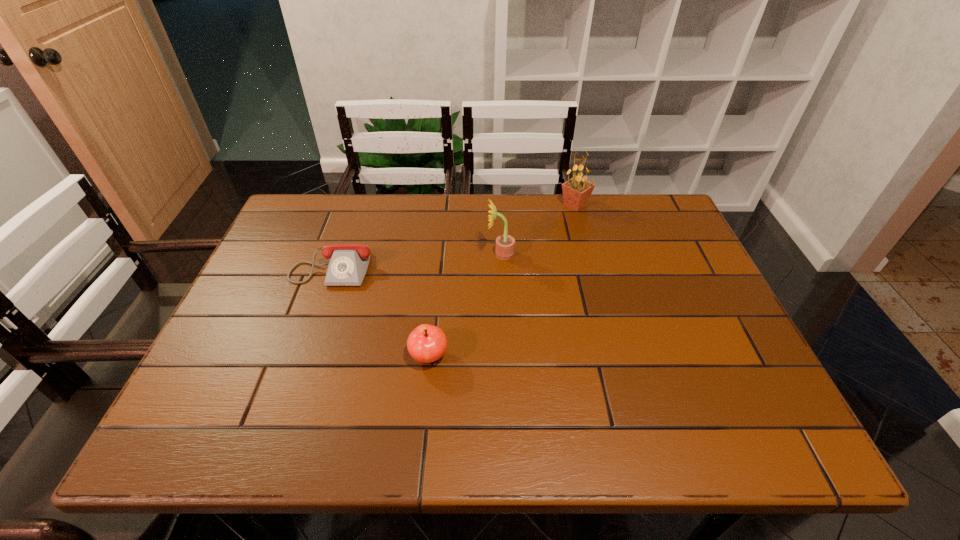
The image size is (960, 540). In order to click on the right sunflower in this screenshot , I will do `click(576, 191)`.

The image size is (960, 540). Find the location of `the farther sunflower`. the farther sunflower is located at coordinates coord(576,191).

The width and height of the screenshot is (960, 540). What are the coordinates of `the left sunflower` in the screenshot? It's located at (505, 244).

This screenshot has width=960, height=540. I want to click on the second object from right to left, so click(505, 244).

Locate an element on the screen. This screenshot has height=540, width=960. apple is located at coordinates (427, 343).

Find the location of `the third tallest object`. the third tallest object is located at coordinates (427, 343).

You are a GUI agent. You are given a task and a screenshot of the screen. Output one action in this format:
    pyautogui.click(x=<x>, y=<y>)
    Task: Click on the shortest object
    The height and width of the screenshot is (540, 960).
    Given the screenshot: What is the action you would take?
    pyautogui.click(x=348, y=264)

Locate an element on the screen. The image size is (960, 540). the leftmost object is located at coordinates (348, 264).

Find the location of `vacant region located at the front of the farther sunflower with flowers visible`. vacant region located at the front of the farther sunflower with flowers visible is located at coordinates (542, 205).

Locate an element on the screen. This screenshot has height=540, width=960. free space located 0.180m at the front of the farther sunflower with flowers visible is located at coordinates (501, 205).